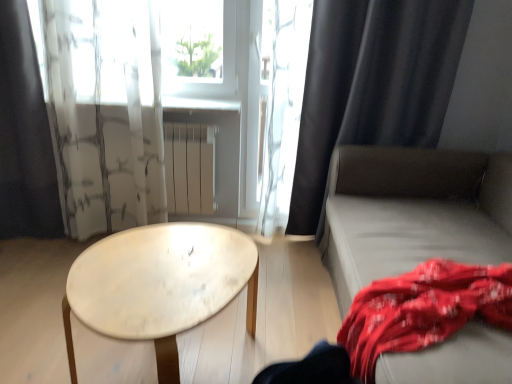
Question: Considering the relative sizes of white matte radiator at center and white marble table at center in the image provided, is white matte radiator at center bigger than white marble table at center?

Choices:
 (A) no
 (B) yes

Answer: (A)

Question: Does white matte radiator at center come behind white marble table at center?

Choices:
 (A) no
 (B) yes

Answer: (B)

Question: Is white matte radiator at center far away from white marble table at center?

Choices:
 (A) yes
 (B) no

Answer: (B)

Question: Can you confirm if white matte radiator at center is shorter than white marble table at center?

Choices:
 (A) no
 (B) yes

Answer: (A)

Question: Is white matte radiator at center facing towards white marble table at center?

Choices:
 (A) yes
 (B) no

Answer: (A)

Question: Can you confirm if white matte radiator at center is smaller than white marble table at center?

Choices:
 (A) no
 (B) yes

Answer: (B)

Question: Considering the relative sizes of white matte radiator at center and light gray fabric couch at right in the image provided, is white matte radiator at center smaller than light gray fabric couch at right?

Choices:
 (A) no
 (B) yes

Answer: (B)

Question: Is white matte radiator at center at the left side of light gray fabric couch at right?

Choices:
 (A) no
 (B) yes

Answer: (B)

Question: Can you confirm if white matte radiator at center is bigger than light gray fabric couch at right?

Choices:
 (A) yes
 (B) no

Answer: (B)

Question: Is white matte radiator at center placed right next to light gray fabric couch at right?

Choices:
 (A) yes
 (B) no

Answer: (B)

Question: Can you confirm if white matte radiator at center is shorter than light gray fabric couch at right?

Choices:
 (A) no
 (B) yes

Answer: (B)

Question: Does white matte radiator at center appear on the right side of light gray fabric couch at right?

Choices:
 (A) yes
 (B) no

Answer: (B)

Question: Does translucent white curtain at upper center, which ranks as the 2th curtain in left-to-right order, have a greater width compared to red cotton blanket at lower right?

Choices:
 (A) no
 (B) yes

Answer: (A)